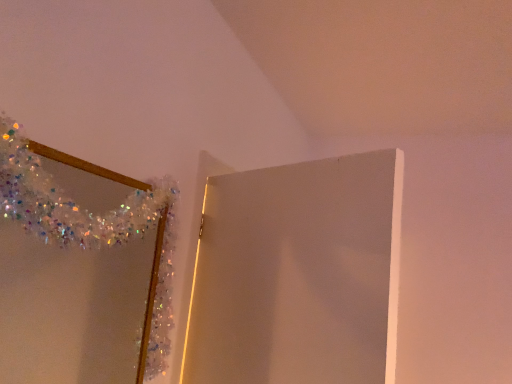
Question: Is white glossy door at upper center smaller than shiny metallic mirror at upper left?

Choices:
 (A) no
 (B) yes

Answer: (A)

Question: Does white glossy door at upper center have a larger size compared to shiny metallic mirror at upper left?

Choices:
 (A) no
 (B) yes

Answer: (B)

Question: Considering the relative positions of white glossy door at upper center and shiny metallic mirror at upper left in the image provided, is white glossy door at upper center to the right of shiny metallic mirror at upper left from the viewer's perspective?

Choices:
 (A) no
 (B) yes

Answer: (B)

Question: Does white glossy door at upper center touch shiny metallic mirror at upper left?

Choices:
 (A) no
 (B) yes

Answer: (A)

Question: Considering the relative sizes of white glossy door at upper center and shiny metallic mirror at upper left in the image provided, is white glossy door at upper center thinner than shiny metallic mirror at upper left?

Choices:
 (A) yes
 (B) no

Answer: (B)

Question: From the image's perspective, is white glossy door at upper center below shiny metallic mirror at upper left?

Choices:
 (A) no
 (B) yes

Answer: (B)

Question: From the image's perspective, is shiny metallic mirror at upper left located beneath white glossy door at upper center?

Choices:
 (A) yes
 (B) no

Answer: (B)

Question: Is shiny metallic mirror at upper left at the right side of white glossy door at upper center?

Choices:
 (A) no
 (B) yes

Answer: (A)

Question: Is the position of shiny metallic mirror at upper left less distant than that of white glossy door at upper center?

Choices:
 (A) yes
 (B) no

Answer: (A)

Question: Would you say shiny metallic mirror at upper left is a long distance from white glossy door at upper center?

Choices:
 (A) no
 (B) yes

Answer: (A)

Question: From the image's perspective, is shiny metallic mirror at upper left over white glossy door at upper center?

Choices:
 (A) no
 (B) yes

Answer: (B)

Question: Does shiny metallic mirror at upper left come behind white glossy door at upper center?

Choices:
 (A) yes
 (B) no

Answer: (B)

Question: Is point (75, 216) closer or farther from the camera than point (286, 347)?

Choices:
 (A) farther
 (B) closer

Answer: (B)